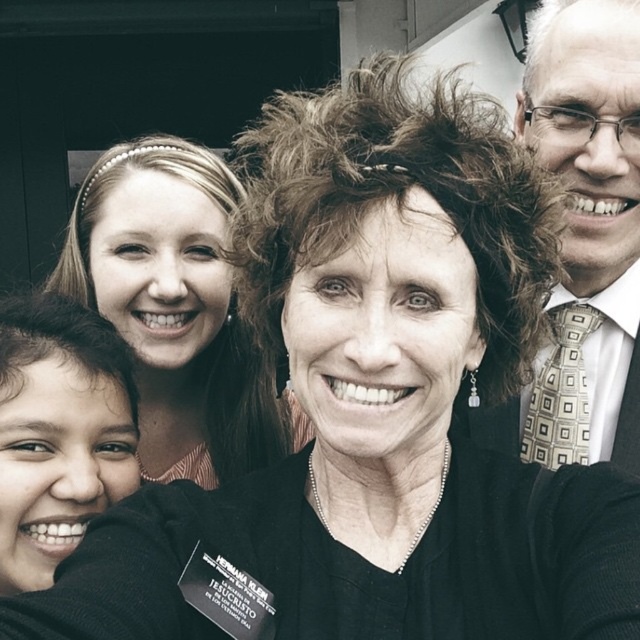
You are taking a photo of the group and notice the smooth skin face at lower left and the matte black hair at center. Which one is blocking the view of the other?

The smooth skin face at lower left is behind the matte black hair at center, so the matte black hair at center is blocking the view of the smooth skin face at lower left.

You are a photographer trying to capture a group photo. You notice the matte black hair at center and the smooth skin face at lower left in your frame. Which object in your viewfinder appears wider?

The matte black hair at center appears wider than the smooth skin face at lower left because its width is larger.